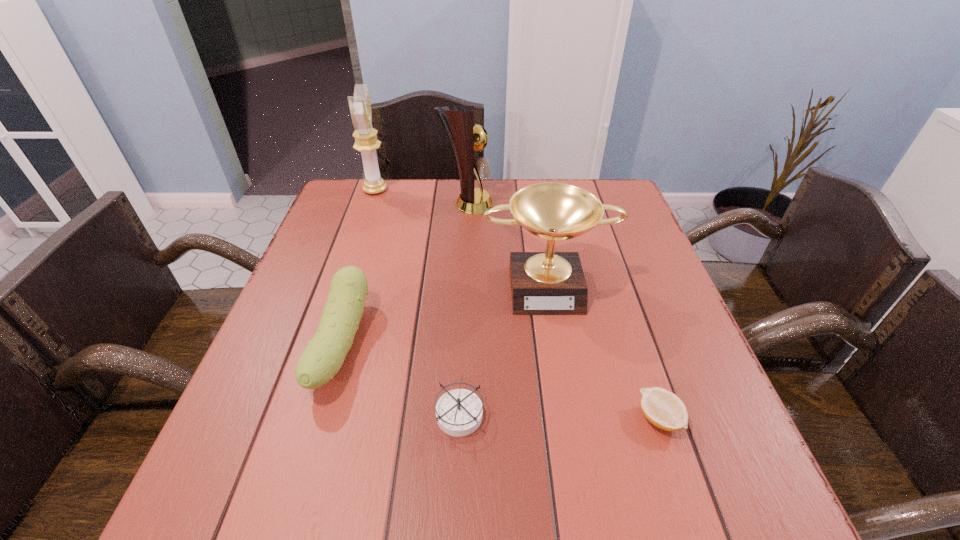
This screenshot has width=960, height=540. I want to click on free space located on the back of the lemon, so click(x=614, y=285).

The width and height of the screenshot is (960, 540). I want to click on award situated at the left edge, so click(x=366, y=142).

Find the location of a particular element. This screenshot has height=540, width=960. cucumber that is positioned at the left edge is located at coordinates (321, 360).

Locate an element on the screen. The width and height of the screenshot is (960, 540). award positioned at the right edge is located at coordinates (542, 283).

Locate an element on the screen. This screenshot has height=540, width=960. lemon that is positioned at the right edge is located at coordinates (665, 410).

Identify the location of object situated at the far left corner. (366, 142).

In the image, there is a desktop. What are the coordinates of `vacant area at the far edge` in the screenshot? It's located at (485, 179).

Locate an element on the screen. The height and width of the screenshot is (540, 960). vacant region at the near edge of the desktop is located at coordinates (425, 488).

Identify the location of vacant space at the left edge of the desktop. This screenshot has width=960, height=540. (324, 227).

The image size is (960, 540). What are the coordinates of `vacant position at the right edge of the desktop` in the screenshot? It's located at (629, 282).